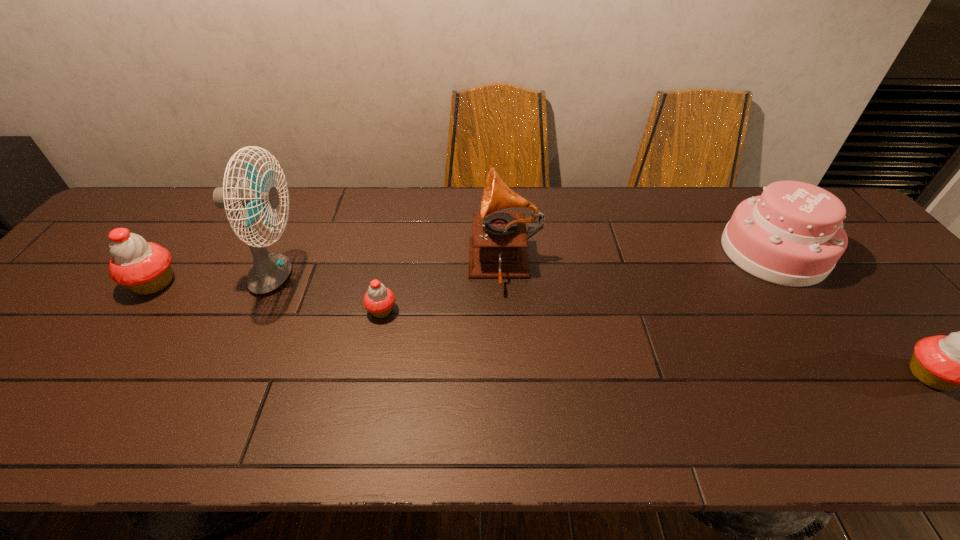
I want to click on free space between the shortest object and the second object from left to right, so click(x=329, y=294).

In order to click on object that ranks as the closest to the phonograph record in this screenshot , I will do `click(379, 300)`.

You are a GUI agent. You are given a task and a screenshot of the screen. Output one action in this format:
    pyautogui.click(x=<x>, y=<y>)
    Task: Click on the object that can be found as the second closest to the shortest cupcake
    This screenshot has height=540, width=960.
    Given the screenshot: What is the action you would take?
    pyautogui.click(x=269, y=270)

Identify which cupcake is the nearest to the fifth object from right to left. Please provide its 2D coordinates. Your answer should be formatted as a tuple, i.e. [(x, y)], where the tuple contains the x and y coordinates of a point satisfying the conditions above.

[(143, 267)]

Identify which cupcake is located as the second nearest to the leftmost object. Please provide its 2D coordinates. Your answer should be formatted as a tuple, i.e. [(x, y)], where the tuple contains the x and y coordinates of a point satisfying the conditions above.

[(959, 360)]

This screenshot has width=960, height=540. Find the location of `vacant space that satisfies the following two spatial constraints: 1. on the front side of the birthday cake; 2. on the horn of the fifth shortest object`. vacant space that satisfies the following two spatial constraints: 1. on the front side of the birthday cake; 2. on the horn of the fifth shortest object is located at coordinates (783, 266).